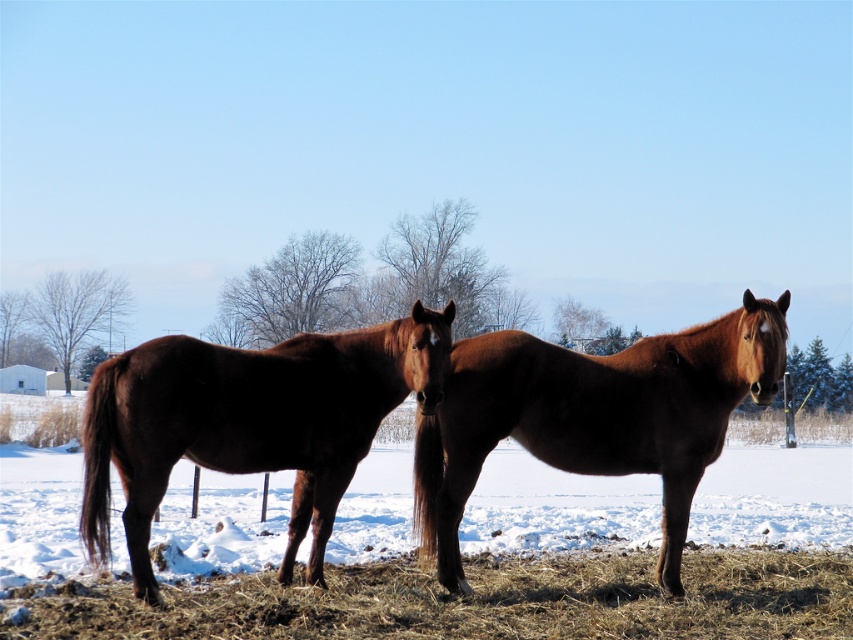
Based on the photo, can you confirm if dry straw at lower center is positioned below brown glossy horse at left?

Correct, dry straw at lower center is located below brown glossy horse at left.

Who is higher up, dry straw at lower center or brown glossy horse at left?

brown glossy horse at left is above.

This screenshot has width=853, height=640. What do you see at coordinates (469, 600) in the screenshot? I see `dry straw at lower center` at bounding box center [469, 600].

At what (x,y) coordinates should I click in order to perform the action: click on dry straw at lower center. Please return your answer as a coordinate pair (x, y). This screenshot has width=853, height=640. Looking at the image, I should click on (469, 600).

Can you confirm if dry straw at lower center is smaller than brown glossy horse at center?

Yes, dry straw at lower center is smaller than brown glossy horse at center.

Who is taller, dry straw at lower center or brown glossy horse at center?

brown glossy horse at center

Which is in front, point (54, 611) or point (653, 406)?

Point (54, 611) is in front.

Where is `dry straw at lower center`? dry straw at lower center is located at coordinates (469, 600).

Who is more forward, (212,394) or (496,356)?

Positioned in front is point (212,394).

Between point (268, 401) and point (541, 420), which one is positioned behind?

Positioned behind is point (541, 420).

You are a GUI agent. You are given a task and a screenshot of the screen. Output one action in this format:
    pyautogui.click(x=<x>, y=<y>)
    Task: Click on the brown glossy horse at left
    This screenshot has width=853, height=640.
    Given the screenshot: What is the action you would take?
    pyautogui.click(x=250, y=420)